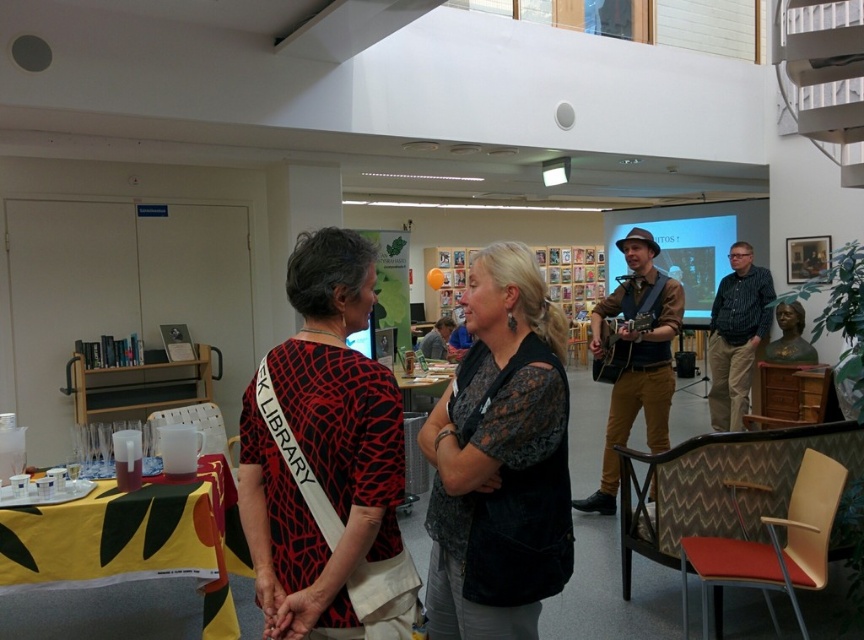
Question: Which of the following is the closest to the observer?

Choices:
 (A) (109, 524)
 (B) (315, 518)

Answer: (B)

Question: Is black printed dress at center wider than yellow fabric table at lower left?

Choices:
 (A) yes
 (B) no

Answer: (B)

Question: In this image, where is black printed dress at center located relative to black lace blouse at center?

Choices:
 (A) left
 (B) right

Answer: (A)

Question: Which point is closer to the camera?

Choices:
 (A) (295, 572)
 (B) (544, 426)
 (C) (65, 536)

Answer: (A)

Question: Which point is closer to the camera taking this photo?

Choices:
 (A) (542, 310)
 (B) (175, 513)
 (C) (379, 442)

Answer: (C)

Question: Is the position of black printed dress at center less distant than that of yellow fabric table at lower left?

Choices:
 (A) no
 (B) yes

Answer: (B)